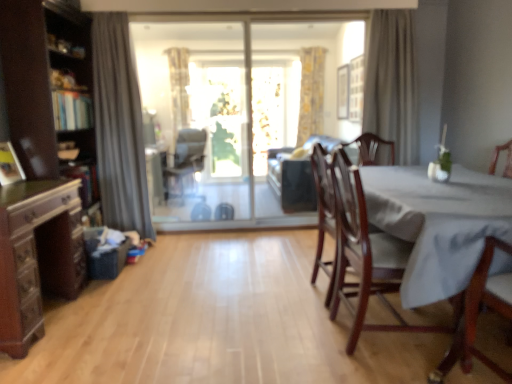
Question: Is mahogany wood chair at right, which is counted as the 2th chair, starting from the left, in front of or behind beige fabric curtain at upper right, acting as the 3th curtain starting from the left, in the image?

Choices:
 (A) front
 (B) behind

Answer: (A)

Question: From the image's perspective, relative to beige fabric curtain at upper right, the 2th curtain viewed from the front, is mahogany wood chair at right, the 2th chair positioned from the right, above or below?

Choices:
 (A) above
 (B) below

Answer: (B)

Question: Estimate the real-world distances between objects in this image. Which object is farther from the matte black chair at center, placed as the third chair when sorted from right to left?

Choices:
 (A) brown wood cabinet at left
 (B) yellow floral fabric curtain at upper center, the second curtain positioned from the right
 (C) suede-like brown couch at center
 (D) transparent glass door at center, the first window screen positioned from the back
 (E) gray fabric curtain at left, which is the 3th curtain in back-to-front order

Answer: (A)

Question: Estimate the real-world distances between objects in this image. Which object is closer to the gray fabric curtain at left, which is the first curtain in left-to-right order?

Choices:
 (A) transparent glass screen door at center
 (B) brown wood cabinet at left
 (C) transparent glass sliding door at center, marked as the first window screen in a front-to-back arrangement
 (D) beige fabric curtain at upper right, acting as the 3th curtain starting from the left
 (E) matte black chair at center, which is the third chair from front to back

Answer: (B)